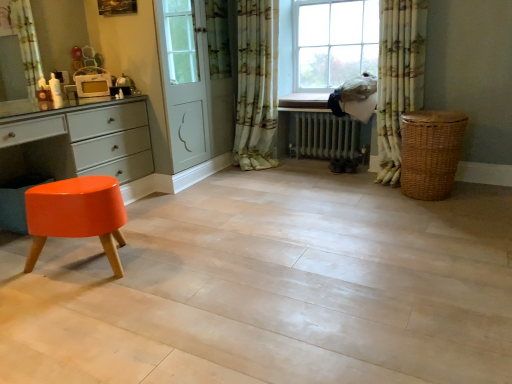
Locate an element on the screen. free spot to the right of orange glossy stool at lower left is located at coordinates (177, 272).